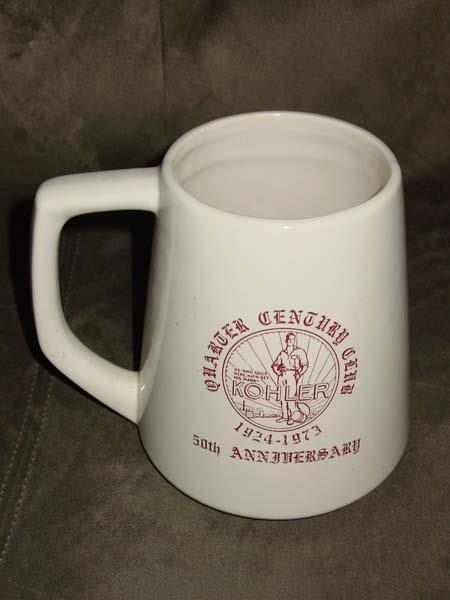
At what (x,y) coordinates should I click in order to perform the action: click on gray wall. Please return your answer as a coordinate pair (x, y). The image size is (450, 600). Looking at the image, I should click on (147, 84).